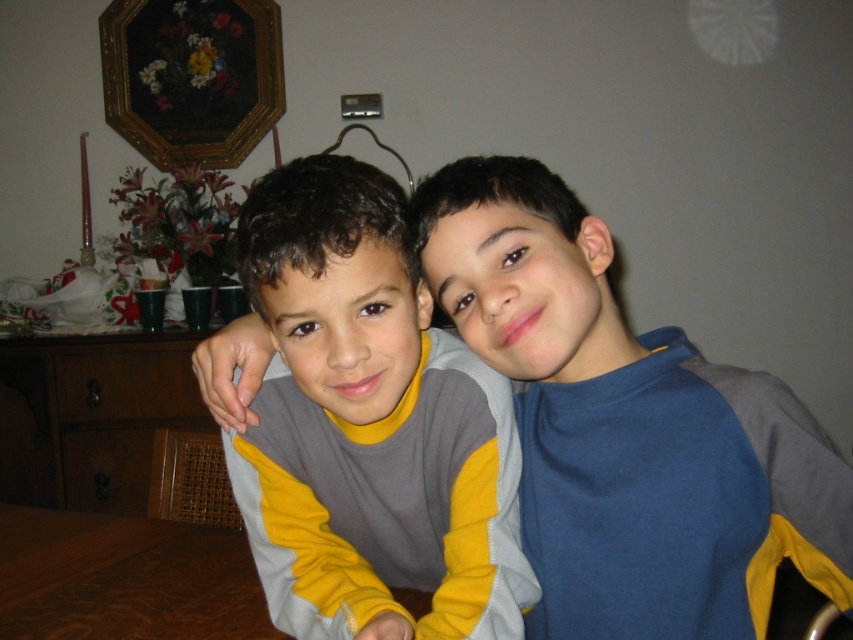
Who is shorter, gray/yellow sweater at center or goldwooden frame at upper left?

Standing shorter between the two is gray/yellow sweater at center.

Is point (258, 490) positioned before point (132, 116)?

Yes.

Does point (465, 572) come closer to viewer compared to point (187, 140)?

Yes, it is in front of point (187, 140).

Locate an element on the screen. The image size is (853, 640). gray/yellow sweater at center is located at coordinates (369, 426).

Between wooden table at lower left and goldwooden frame at upper left, which one has more height?

goldwooden frame at upper left

Describe the element at coordinates (125, 579) in the screenshot. Image resolution: width=853 pixels, height=640 pixels. I see `wooden table at lower left` at that location.

Where is `wooden table at lower left`? This screenshot has height=640, width=853. wooden table at lower left is located at coordinates (125, 579).

Is point (315, 408) positioned in front of point (100, 560)?

Yes, it is in front of point (100, 560).

Does gray/yellow sweater at center appear under wooden table at lower left?

Actually, gray/yellow sweater at center is above wooden table at lower left.

The height and width of the screenshot is (640, 853). In order to click on gray/yellow sweater at center in this screenshot , I will do `click(369, 426)`.

Image resolution: width=853 pixels, height=640 pixels. Identify the location of gray/yellow sweater at center. (369, 426).